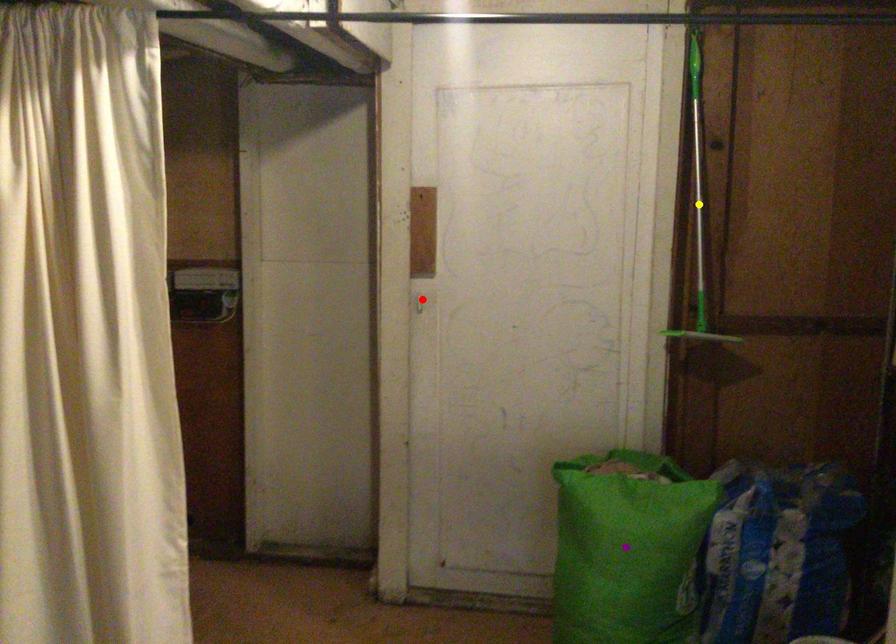
Order these from nearest to farthest:
purple point
yellow point
red point

1. purple point
2. yellow point
3. red point